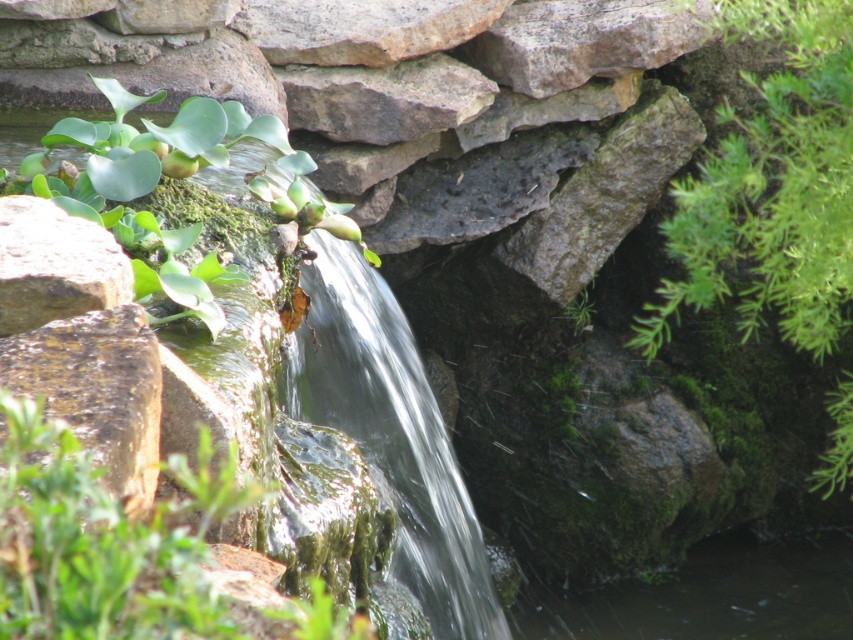
You are standing at the edge of the waterfall and want to pick a leaf from the nearest green leafy plant. Which one should you choose between the green leafy plant at right and the green leafy plant at upper left?

You should choose the green leafy plant at right because it is closer to you than the green leafy plant at upper left.